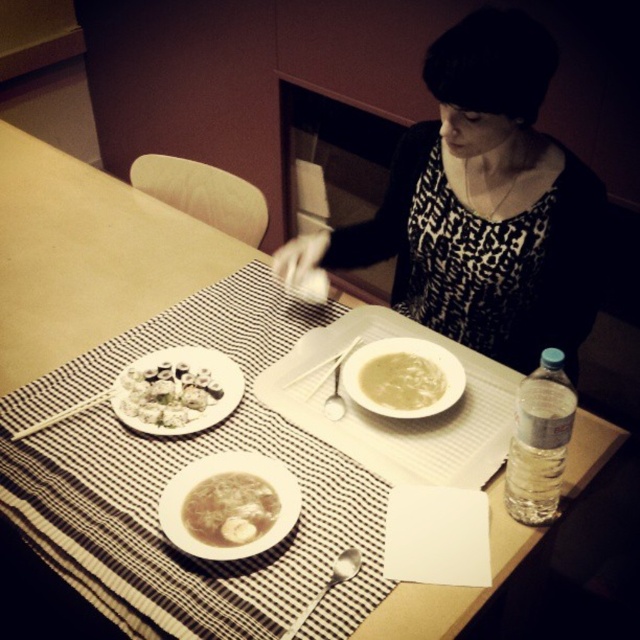
You are looking at the dining table setup. There are two points marked on the table surface at coordinates point (484,332) and point (93,397). From your perspective, which point is closer to you?

Point (484,332) is further to the camera than point (93,397), so the point closer to you is point (93,397).

You are a person sitting at the table. You want to reach for the transparent plastic water bottle at lower right and the satin silver spoon at lower center. Which item will your hand touch first if you extend your arm straight ahead?

The transparent plastic water bottle at lower right is closer to you than the satin silver spoon at lower center, so your hand will touch the transparent plastic water bottle at lower right first.